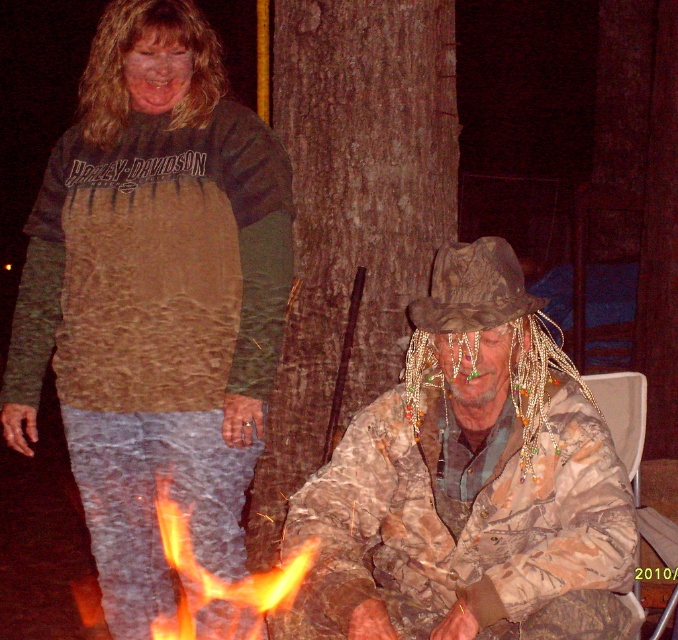
Question: Which object is closer to the camera taking this photo?

Choices:
 (A) camouflage fabric jacket at lower center
 (B) camouflage fabric cowboy hat at center
 (C) flameflame at lower center
 (D) greenish-gray fabric at center

Answer: (A)

Question: Can you confirm if greenish-gray fabric at center is positioned below camouflage fabric cowboy hat at center?

Choices:
 (A) yes
 (B) no

Answer: (A)

Question: Which point is closer to the camera taking this photo?

Choices:
 (A) (219, 609)
 (B) (98, 138)

Answer: (B)

Question: Which point is farther to the camera?

Choices:
 (A) greenish-gray fabric at center
 (B) flameflame at lower center
 (C) camouflage fabric jacket at lower center
 (D) camouflage fabric cowboy hat at center

Answer: (B)

Question: Can you confirm if greenish-gray fabric at center is positioned below brown rough bark at center?

Choices:
 (A) no
 (B) yes

Answer: (B)

Question: Does brown rough bark at center appear on the left side of flameflame at lower center?

Choices:
 (A) no
 (B) yes

Answer: (A)